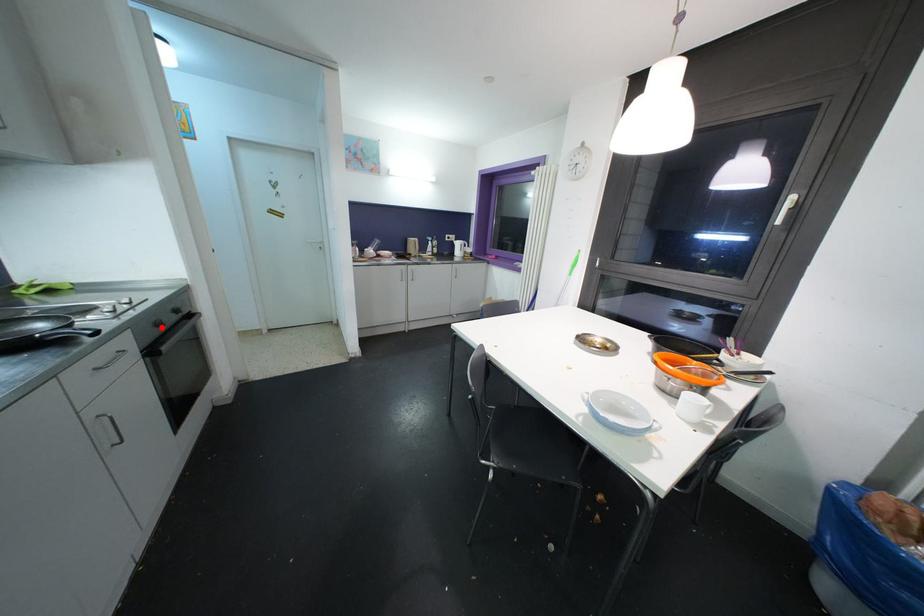
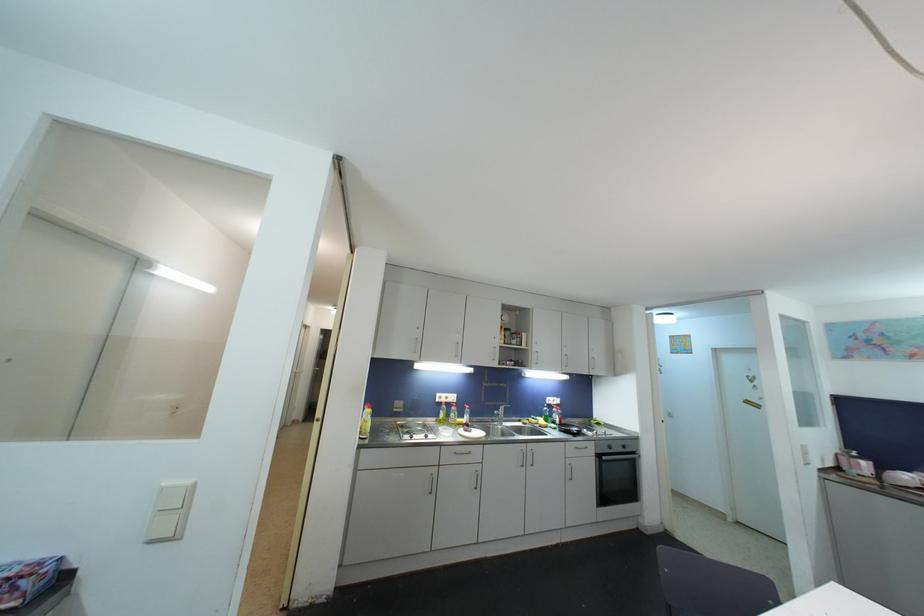
The point at the highlighted location is marked in the first image. Where is the corresponding point in the second image?

(613, 450)